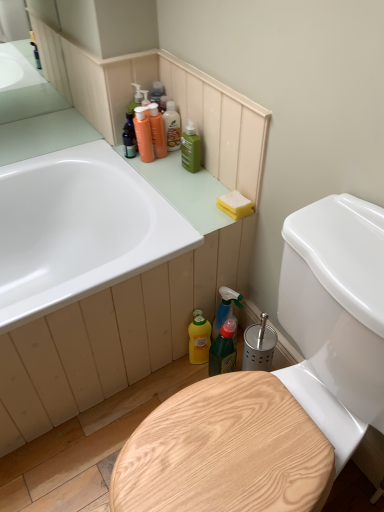
Identify the location of vacant space to the right of matte orange bottles at upper left, which ranks as the 3th cleaning product in top-to-bottom order. This screenshot has width=384, height=512. (184, 165).